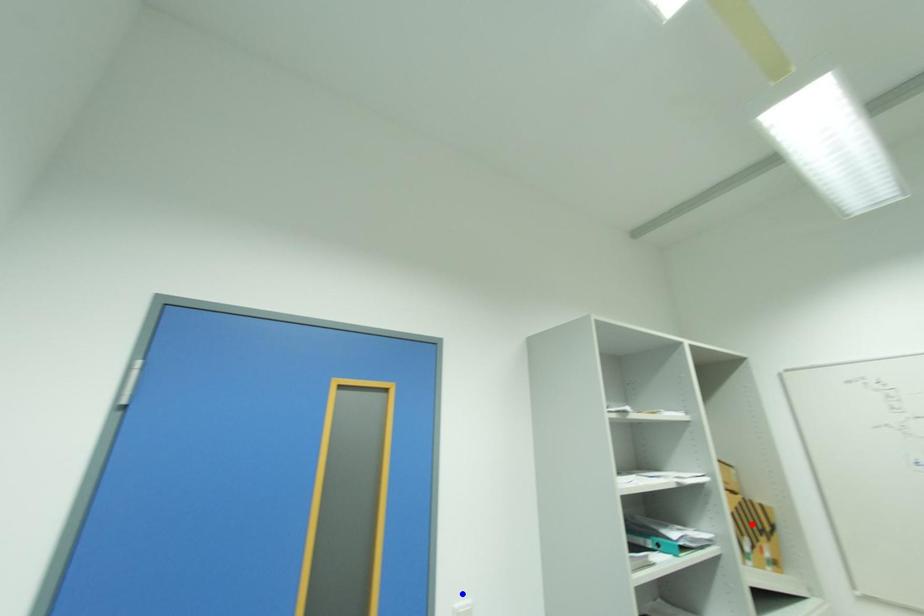
Question: Which of the two points in the image is closer to the camera?

Choices:
 (A) Blue point is closer.
 (B) Red point is closer.

Answer: (A)